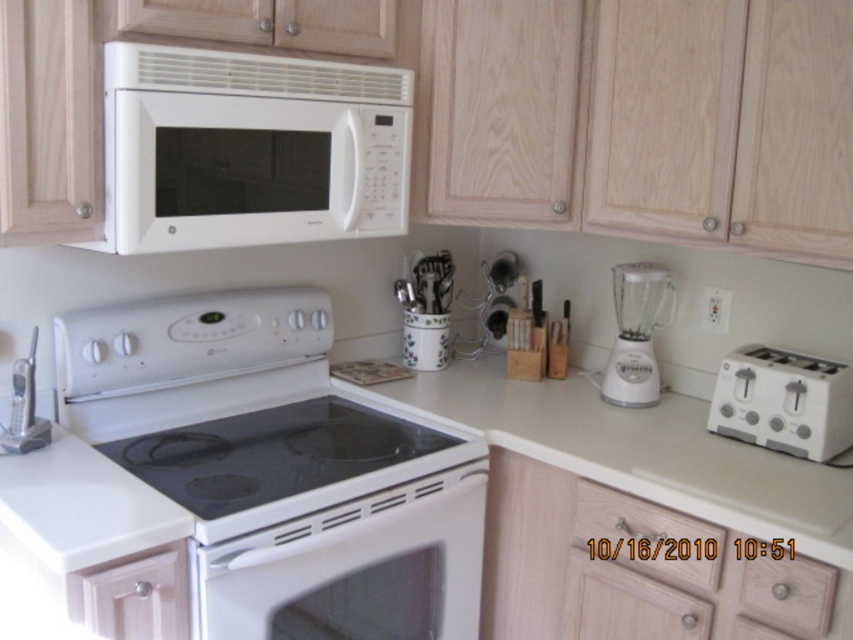
You are trying to reach the white matte microwave at upper center to heat up leftovers. Is the white glossy oven at center in your way?

The white matte microwave at upper center is above the white glossy oven at center, so the oven is below the microwave. Since the oven is lower, it might block your access to the microwave unless you can reach over it.

You are trying to locate the oven in the kitchen. You see the white matte microwave at upper center and the white glossy oven at center. Which one is more to the right?

The white glossy oven at center is more to the right than the white matte microwave at upper center.

You are preparing breakfast and need to place both the white plastic toaster at right and the white plastic blender at right on the counter. Which one will take up more space?

The white plastic blender at right takes up more space because it has a larger size compared to the white plastic toaster at right.